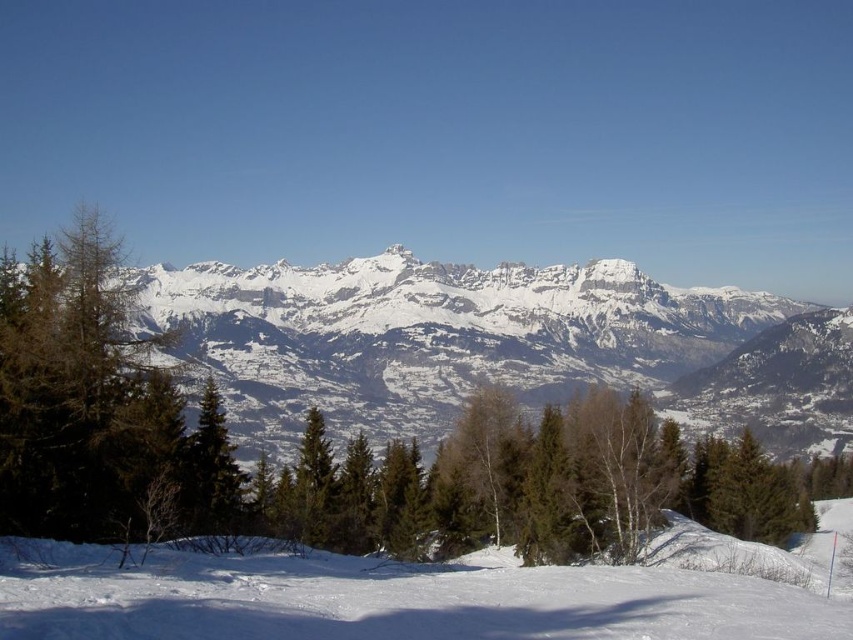
Is point (310, 352) farther from viewer compared to point (699, 550)?

Yes, it is.

Who is positioned more to the right, white snow-covered mountain range at center or white powdery snow at lower center?

Positioned to the right is white powdery snow at lower center.

Measure the distance between white snow-covered mountain range at center and camera.

white snow-covered mountain range at center is 1707.27 feet from camera.

I want to click on white snow-covered mountain range at center, so click(x=492, y=346).

Is white powdery snow at lower center positioned in front of green matte tree at center?

Yes, white powdery snow at lower center is in front of green matte tree at center.

Between point (437, 596) and point (201, 502), which one is positioned in front?

Point (437, 596)

Image resolution: width=853 pixels, height=640 pixels. What are the coordinates of `white powdery snow at lower center` in the screenshot? It's located at (428, 595).

Between white snow-covered mountain range at center and green matte tree at center, which one appears on the left side from the viewer's perspective?

green matte tree at center

Is white snow-covered mountain range at center thinner than green matte tree at center?

No, white snow-covered mountain range at center is not thinner than green matte tree at center.

The width and height of the screenshot is (853, 640). I want to click on white snow-covered mountain range at center, so click(492, 346).

This screenshot has height=640, width=853. What are the coordinates of `white snow-covered mountain range at center` in the screenshot? It's located at (492, 346).